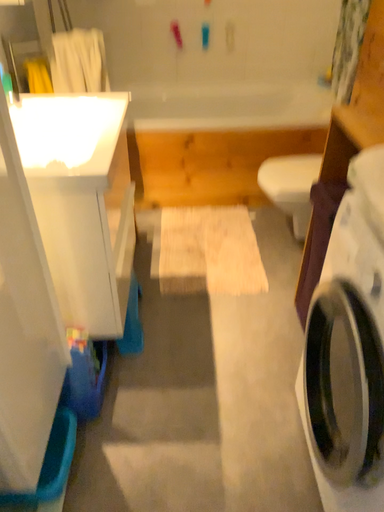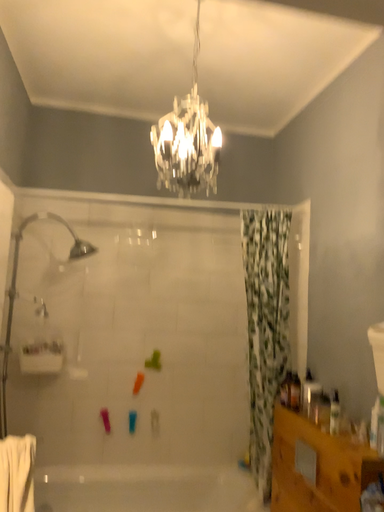
Question: Which way did the camera rotate in the video?

Choices:
 (A) rotated upward
 (B) rotated downward

Answer: (A)